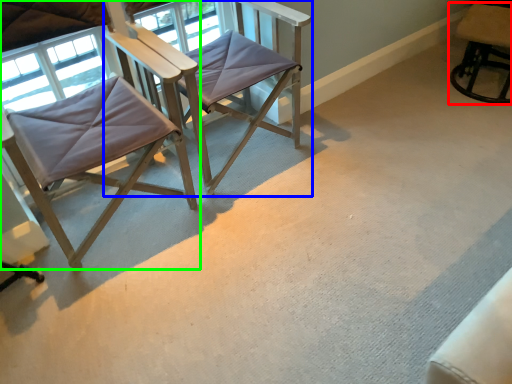
Question: Which object is the farthest from chair (highlighted by a red box)? Choose among these: chair (highlighted by a blue box) or chair (highlighted by a green box).

Choices:
 (A) chair
 (B) chair

Answer: (B)